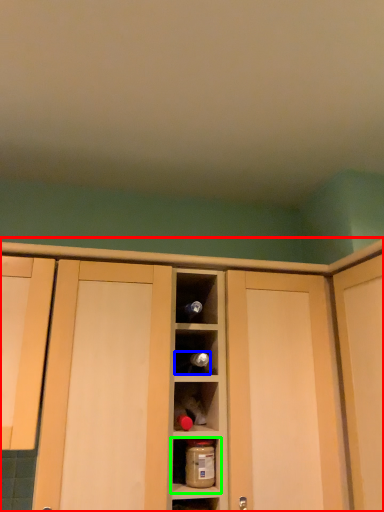
Question: Which object is positioned farthest from cabinetry (highlighted by a red box)? Select from wine bottle (highlighted by a blue box) and shelf (highlighted by a green box).

Choices:
 (A) wine bottle
 (B) shelf

Answer: (B)